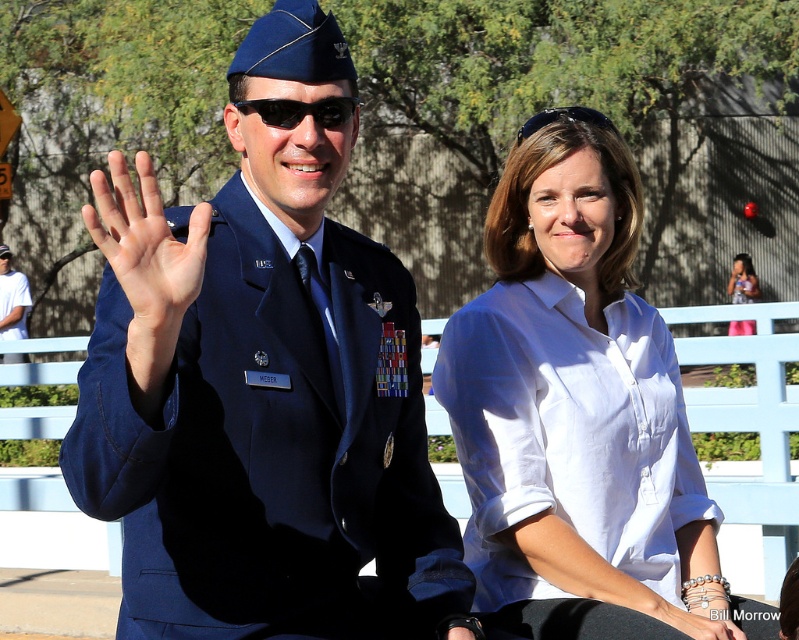
You are a photographer trying to capture a clear photo of both the white cotton shirt at center and the black plastic sunglasses at center. Since the camera can only focus on one object at a time, which object should you focus on to ensure it fills the frame more?

The white cotton shirt at center might be wider than black plastic sunglasses at center, so focusing on the white cotton shirt at center would ensure it fills the frame more.